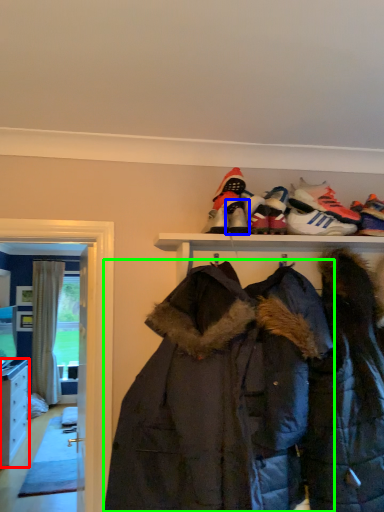
Question: Considering the real-world distances, which object is closest to cabinetry (highlighted by a red box)? footwear (highlighted by a blue box) or jacket (highlighted by a green box).

Choices:
 (A) footwear
 (B) jacket

Answer: (B)